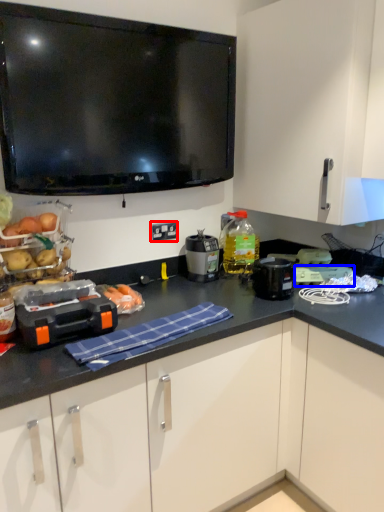
Question: Which point is further to the camera, electric outlet (highlighted by a red box) or appliance (highlighted by a blue box)?

Choices:
 (A) electric outlet
 (B) appliance

Answer: (A)